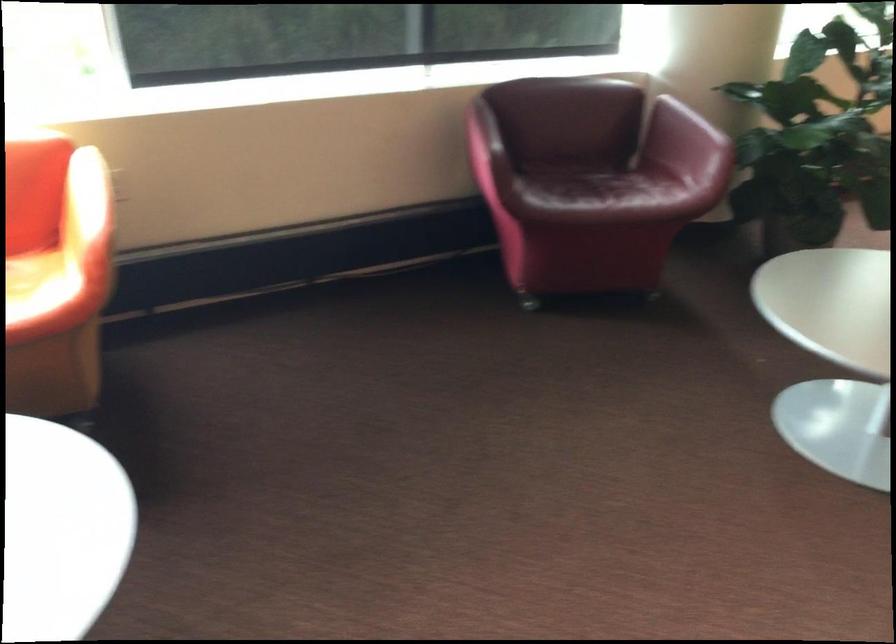
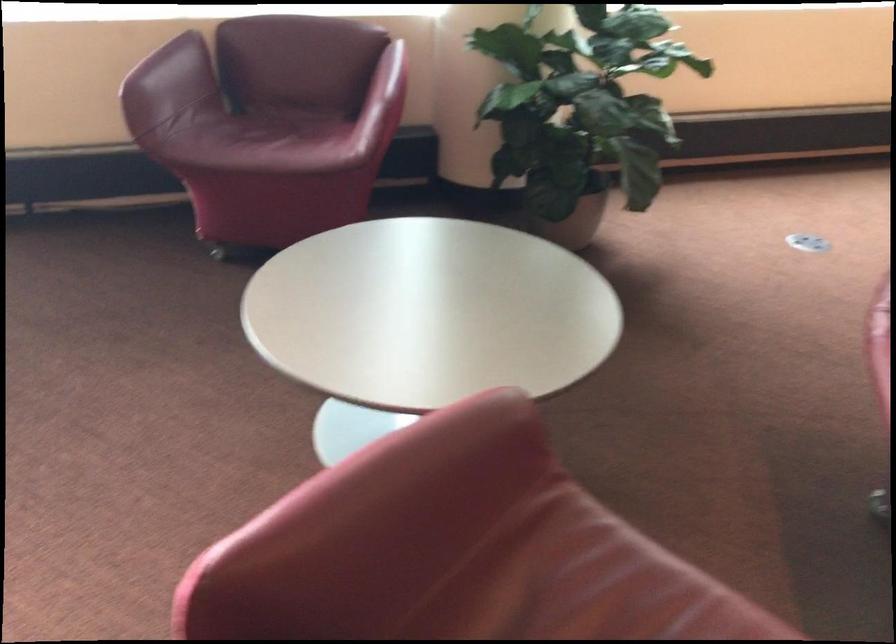
Find the pixel in the second image that matches point 731,144 in the first image.

(385, 100)